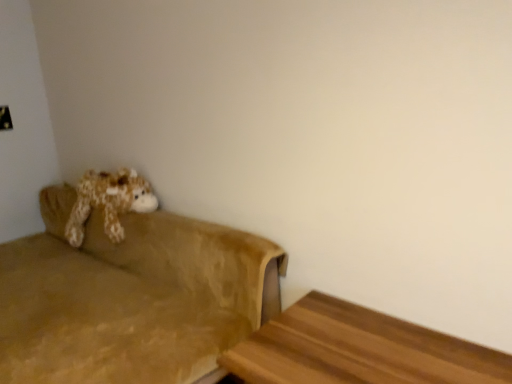
Question: Is fluffy brown plush at left located outside suede-like brown couch at left?

Choices:
 (A) yes
 (B) no

Answer: (B)

Question: Does fluffy brown plush at left appear on the right side of suede-like brown couch at left?

Choices:
 (A) yes
 (B) no

Answer: (A)

Question: Can you confirm if fluffy brown plush at left is smaller than suede-like brown couch at left?

Choices:
 (A) no
 (B) yes

Answer: (B)

Question: From the image's perspective, is fluffy brown plush at left below suede-like brown couch at left?

Choices:
 (A) no
 (B) yes

Answer: (A)

Question: Is fluffy brown plush at left aimed at suede-like brown couch at left?

Choices:
 (A) no
 (B) yes

Answer: (B)

Question: Considering the positions of point (245, 362) and point (134, 203), is point (245, 362) closer or farther from the camera than point (134, 203)?

Choices:
 (A) closer
 (B) farther

Answer: (A)

Question: Is wooden table at lower right inside the boundaries of fluffy brown plush at left, or outside?

Choices:
 (A) inside
 (B) outside

Answer: (B)

Question: In terms of height, does wooden table at lower right look taller or shorter compared to fluffy brown plush at left?

Choices:
 (A) short
 (B) tall

Answer: (A)

Question: From a real-world perspective, is wooden table at lower right above or below fluffy brown plush at left?

Choices:
 (A) above
 (B) below

Answer: (B)

Question: Is wooden table at lower right bigger or smaller than suede-like brown couch at left?

Choices:
 (A) small
 (B) big

Answer: (A)

Question: Is wooden table at lower right wider or thinner than suede-like brown couch at left?

Choices:
 (A) wide
 (B) thin

Answer: (B)

Question: Considering the positions of wooden table at lower right and suede-like brown couch at left in the image, is wooden table at lower right taller or shorter than suede-like brown couch at left?

Choices:
 (A) short
 (B) tall

Answer: (A)

Question: From a real-world perspective, relative to suede-like brown couch at left, is wooden table at lower right vertically above or below?

Choices:
 (A) below
 (B) above

Answer: (A)

Question: Is suede-like brown couch at left bigger or smaller than wooden table at lower right?

Choices:
 (A) big
 (B) small

Answer: (A)

Question: Relative to wooden table at lower right, is suede-like brown couch at left in front or behind?

Choices:
 (A) behind
 (B) front

Answer: (A)